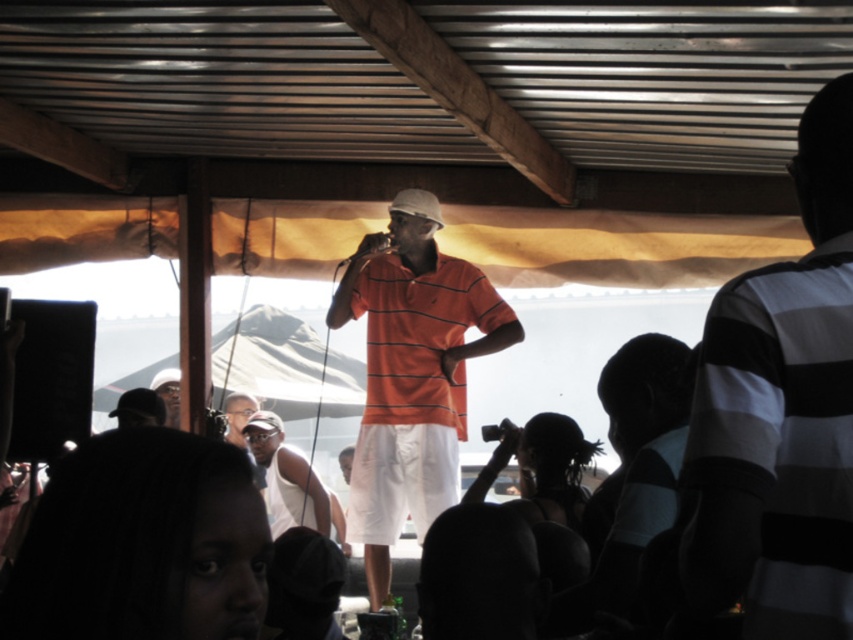
You are a photographer at the event and want to take a photo that includes both the orange striped shirt at center and the white tank top at center. What is the minimum distance you need to move backward to ensure both are in frame?

The orange striped shirt at center and white tank top at center are 1.65 meters apart from each other. To capture both in the frame, the photographer must position themselves far enough back so that the camera can encompass the 1.65 meter distance between them.

You are attending the event and want to know who is closer to the front of the stage between the orange striped polo shirt at center and the white tank top at center. Which one is in front?

The orange striped polo shirt at center is in front of the white tank top at center, so the orange striped polo shirt at center is closer to the front of the stage.

You are an event planner observing the stage setup. You notice two orange striped items at the center of the stage. Which one is taller, the orange striped shirt at center or the orange striped polo shirt at center?

The orange striped shirt at center is taller than the orange striped polo shirt at center according to the description.